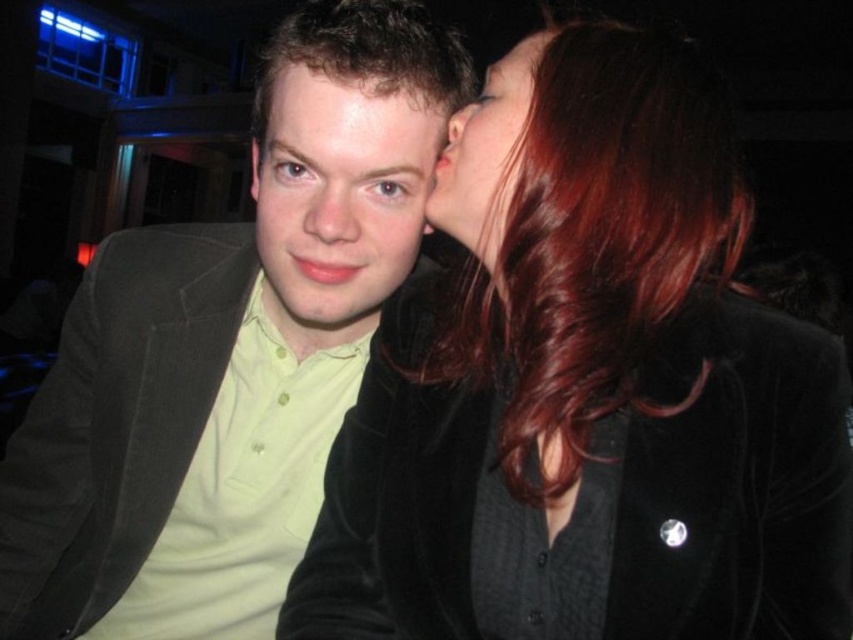
You are a photographer adjusting your camera settings to focus on the subjects in the image. Since you want to capture both the matte green shirt at center and the matte black hair at upper center clearly, which object should you focus on first to ensure depth of field?

The matte green shirt at center is further to the viewer than the matte black hair at upper center. To ensure both are in focus, you should focus on the matte green shirt at center first as it is closer, allowing the depth of field to extend backward to the farther object.

You are a photographer adjusting the focus of your camera. You want to ensure both the matte green shirt at center and the matte black hair at upper center are in focus. The depth of field in your current setting allows objects within 4 inches to be in focus. Can both objects be in focus simultaneously?

The distance between the matte green shirt at center and the matte black hair at upper center is 4.10 inches. Since the depth of field only allows 4 inches, the two objects are slightly beyond the focus range, so they cannot both be in focus at the same time.